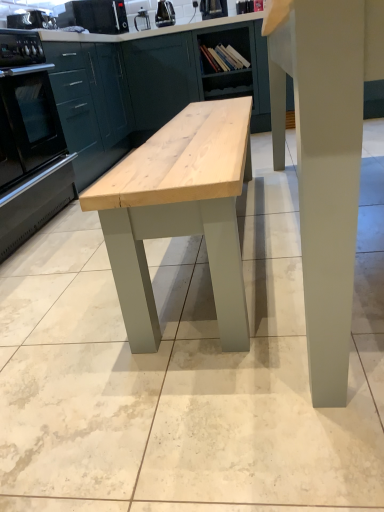
Question: Considering the positions of satin black oven at left and black plastic kettle at upper center, positioned as the 3th appliance in left-to-right order, in the image, is satin black oven at left bigger or smaller than black plastic kettle at upper center, positioned as the 3th appliance in left-to-right order,?

Choices:
 (A) small
 (B) big

Answer: (B)

Question: Based on their positions, is satin black oven at left located to the left or right of black plastic kettle at upper center, positioned as the 3th appliance in left-to-right order?

Choices:
 (A) left
 (B) right

Answer: (A)

Question: Considering the real-world distances, which object is farthest from the matte green cabinet at center, which is the 2th cabinetry in right-to-left order?

Choices:
 (A) black plastic toaster at upper left, which appears as the 2th appliance when viewed from the left
 (B) black plastic kettle at upper center, positioned as the 3th appliance in left-to-right order
 (C) wooden bookshelf at center, arranged as the third cabinetry when viewed from the left
 (D) satin black oven at left
 (E) smooth gray table at center

Answer: (E)

Question: Considering the real-world distances, which object is farthest from the black plastic toaster at upper left, the third appliance in the right-to-left sequence?

Choices:
 (A) matte green cabinet at center, which ranks as the 2th cabinetry in left-to-right order
 (B) satin black oven at left
 (C) black plastic toaster at upper left, positioned as the 4th appliance in right-to-left order
 (D) smooth gray table at center
 (E) metallic silver toaster at upper center, marked as the 4th appliance in a left-to-right arrangement

Answer: (D)